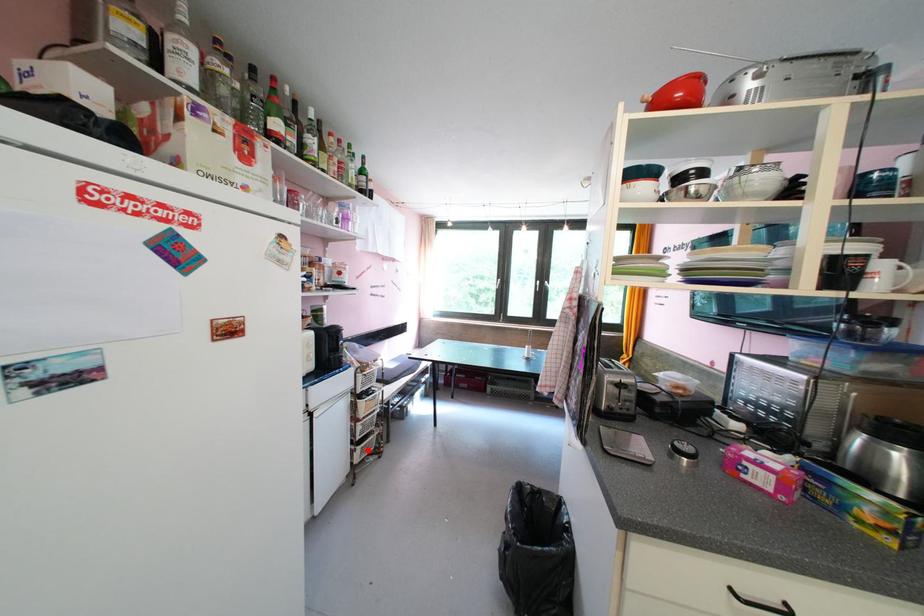
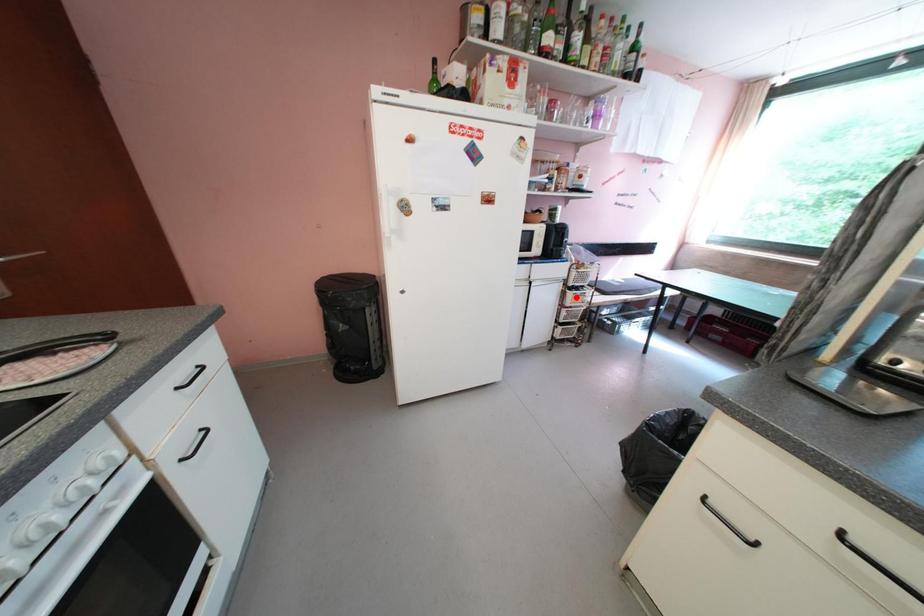
I am providing you with two images of the same scene from different viewpoints. A red point is marked on the first image and another point is marked on the second image. Is the red point in image1 aligned with the point shown in image2?

No